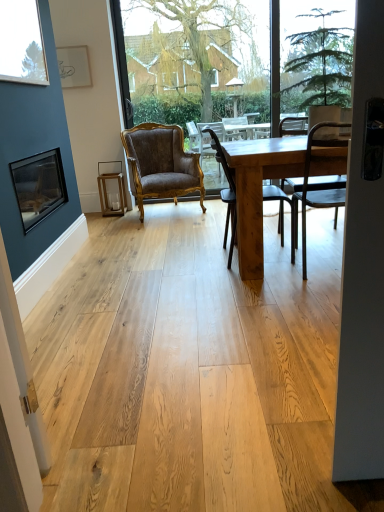
Where is `free space in front of natural wood table at center`? The height and width of the screenshot is (512, 384). free space in front of natural wood table at center is located at coordinates (264, 312).